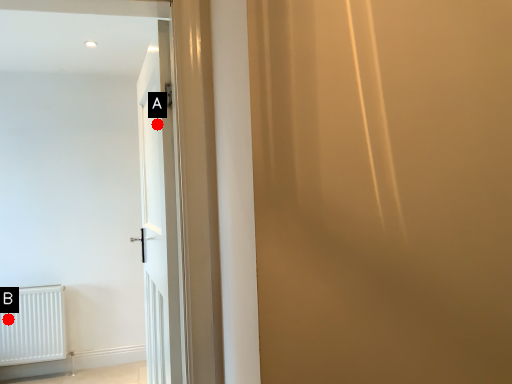
Question: Two points are circled on the image, labeled by A and B beside each circle. Which point appears farthest from the camera in this image?

Choices:
 (A) A is further
 (B) B is further

Answer: (B)